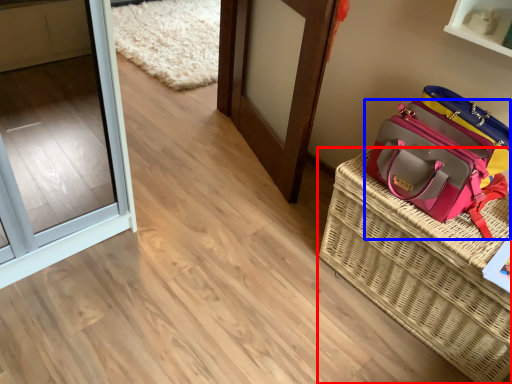
Question: Which object is closer to the camera taking this photo, picnic basket (highlighted by a red box) or handbag (highlighted by a blue box)?

Choices:
 (A) picnic basket
 (B) handbag

Answer: (A)